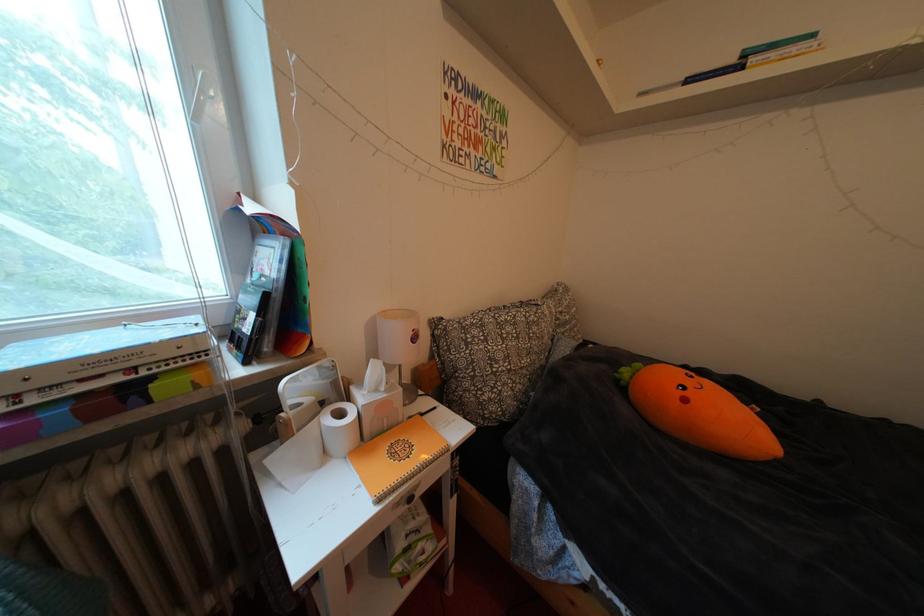
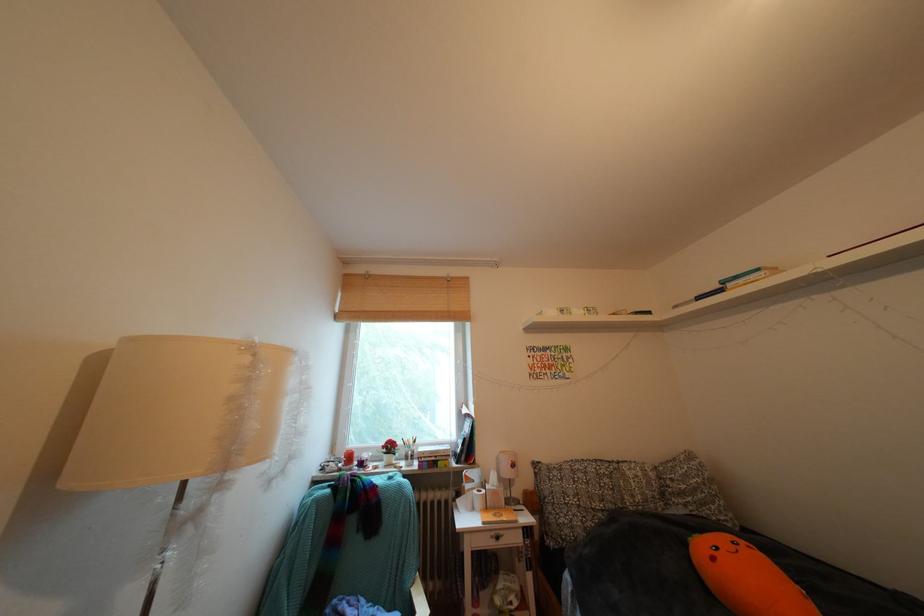
Find the pixel in the second image that matches point (270, 331) in the first image.

(472, 456)